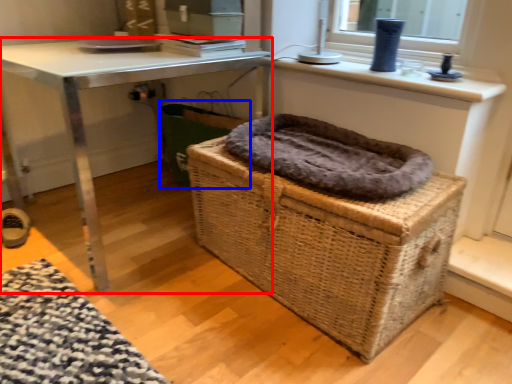
Question: Which object appears farthest to the camera in this image, table (highlighted by a red box) or laundry basket (highlighted by a blue box)?

Choices:
 (A) table
 (B) laundry basket

Answer: (B)